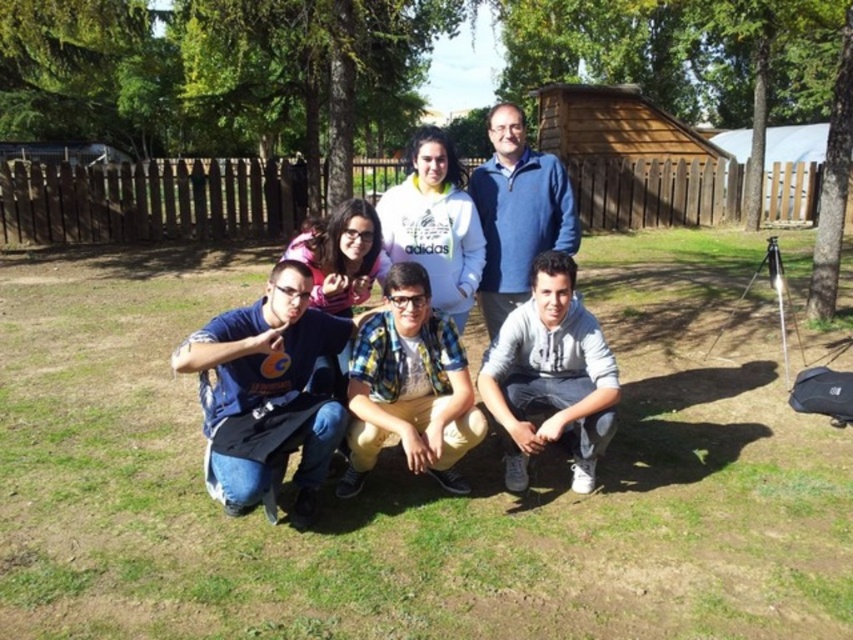
Question: Which of the following is the closest to the observer?

Choices:
 (A) green grass at lower center
 (B) blue cotton t-shirt at lower left

Answer: (A)

Question: Which object is the farthest from the checkered fabric shirt at center?

Choices:
 (A) wooden hut at upper center
 (B) gray cotton hoodie at lower right

Answer: (A)

Question: Observing the image, what is the correct spatial positioning of green grass at lower center in reference to wooden hut at upper center?

Choices:
 (A) below
 (B) above

Answer: (A)

Question: Is gray cotton hoodie at lower right smaller than white fleece jacket at center?

Choices:
 (A) yes
 (B) no

Answer: (B)

Question: Among these objects, which one is farthest from the camera?

Choices:
 (A) wooden hut at upper center
 (B) blue fleece jacket at upper center
 (C) green grass at lower center
 (D) white fleece jacket at center

Answer: (A)

Question: Does blue cotton t-shirt at lower left appear over white fleece jacket at center?

Choices:
 (A) yes
 (B) no

Answer: (B)